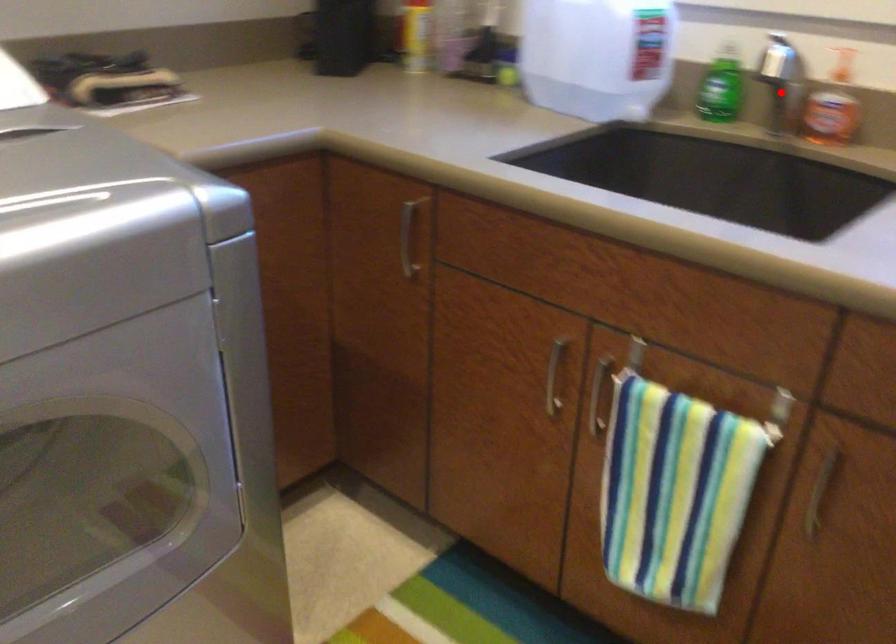
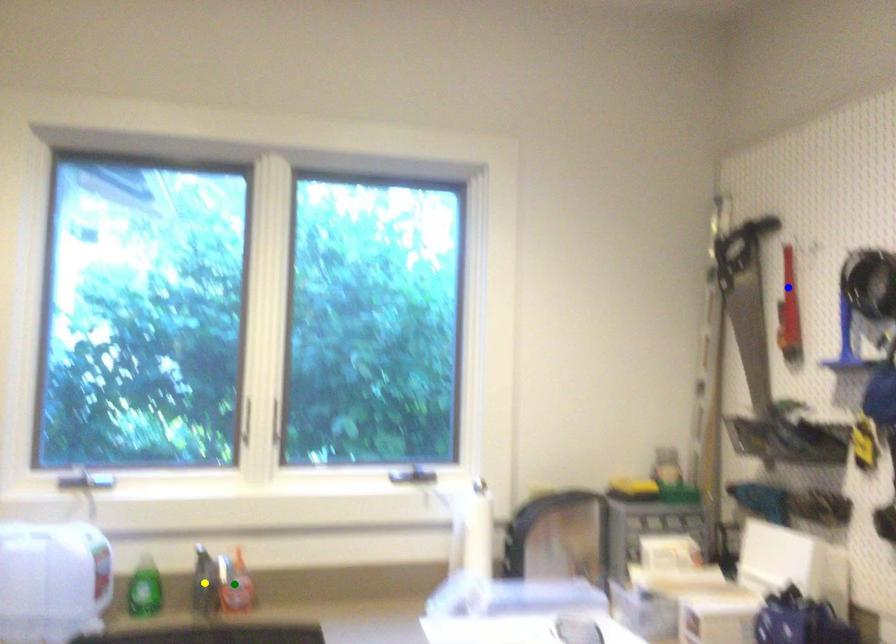
Question: I am providing you with two images of the same scene from different viewpoints. A red point is marked on the first image. You are given multiple points on the second image. Which spot in image 2 lines up with the point in image 1?

Choices:
 (A) green point
 (B) yellow point
 (C) blue point

Answer: (B)